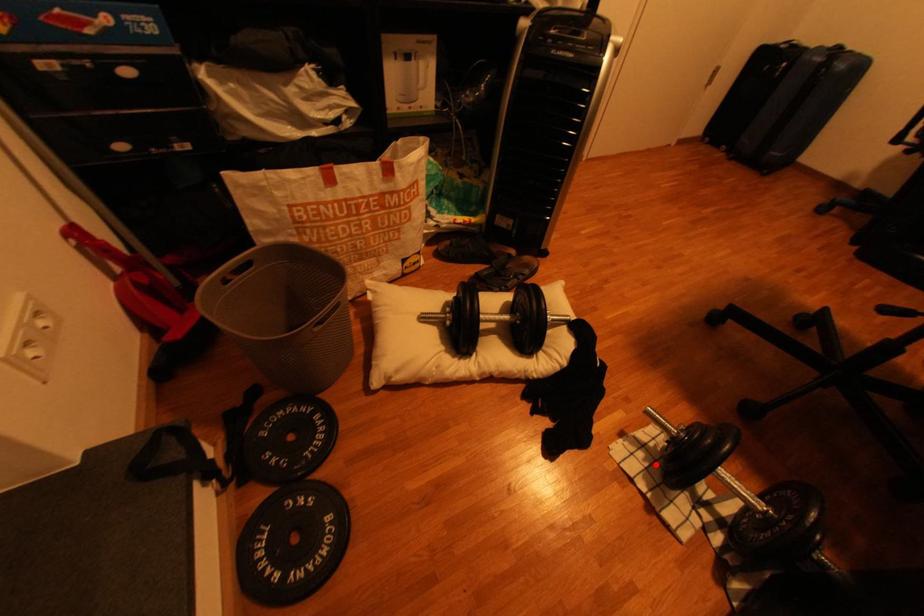
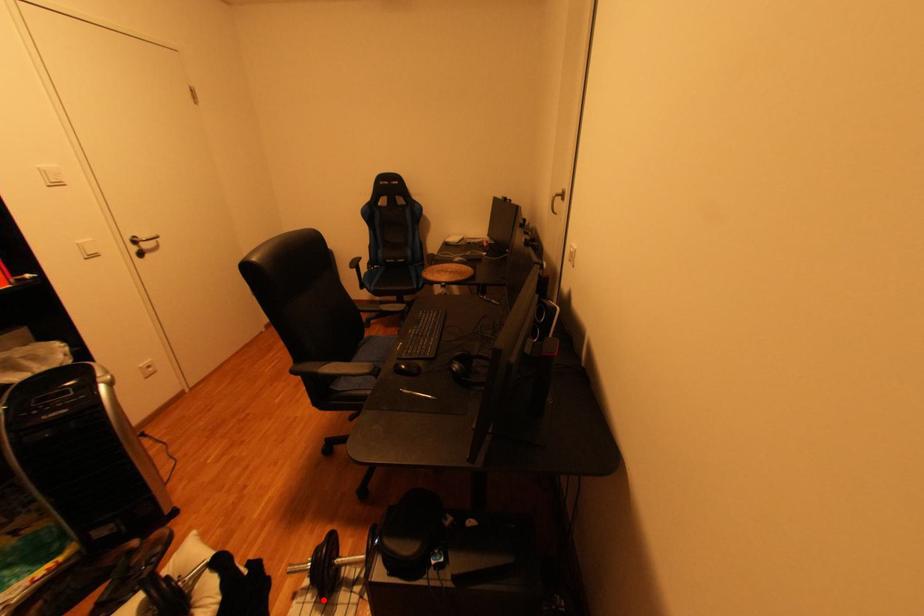
I am providing you with two images of the same scene from different viewpoints. A red point is marked on the first image and another point is marked on the second image. Is the red point in image1 aligned with the point shown in image2?

Yes